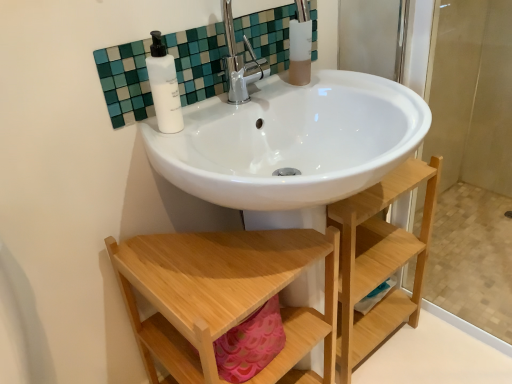
Question: In terms of height, does natural wood shelf at lower center look taller or shorter compared to translucent frosted glass cup at upper center?

Choices:
 (A) tall
 (B) short

Answer: (A)

Question: Looking at the image, does natural wood shelf at lower center seem bigger or smaller compared to translucent frosted glass cup at upper center?

Choices:
 (A) small
 (B) big

Answer: (B)

Question: Considering the real-world distances, which object is closest to the white matte bottle at upper center?

Choices:
 (A) translucent frosted glass cup at upper center
 (B) white glossy sink at upper center
 (C) natural wood shelf at lower center

Answer: (B)

Question: Estimate the real-world distances between objects in this image. Which object is farther from the natural wood shelf at lower center?

Choices:
 (A) translucent frosted glass cup at upper center
 (B) white glossy sink at upper center
 (C) white matte bottle at upper center

Answer: (A)